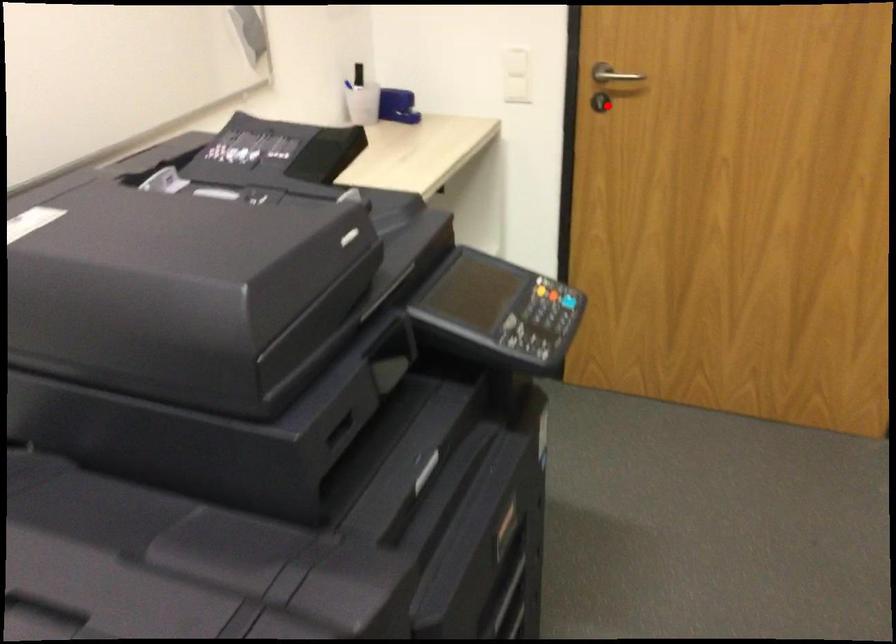
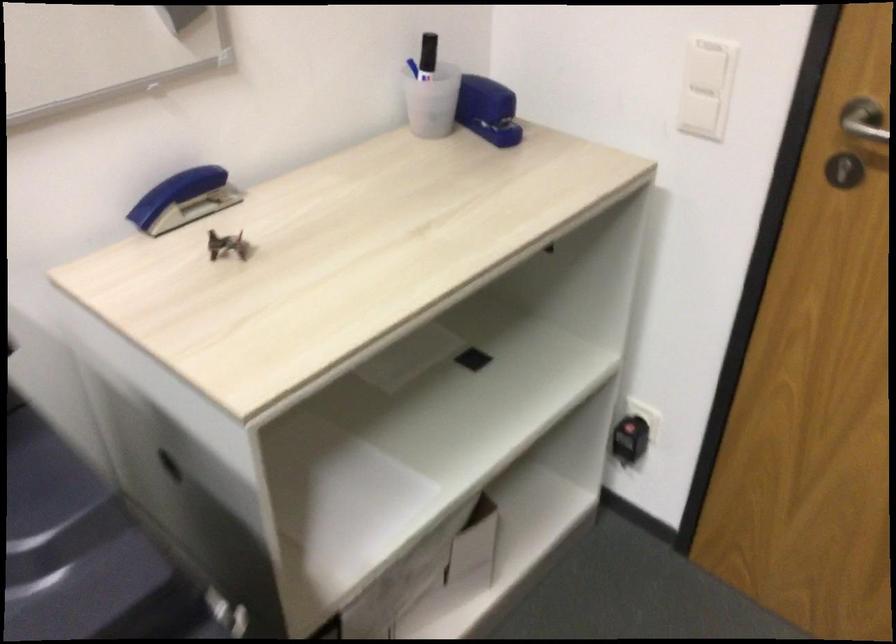
Question: I am providing you with two images of the same scene from different viewpoints. A red point is shown in image1. For the corresponding object point in image2, is it positioned nearer or farther from the camera?

Choices:
 (A) Nearer
 (B) Farther

Answer: (A)